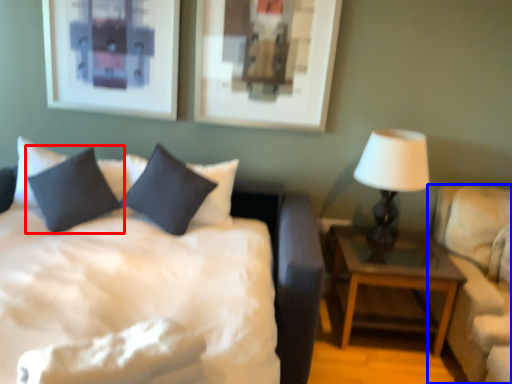
Question: Which point is closer to the camera, pillow (highlighted by a red box) or studio couch (highlighted by a blue box)?

Choices:
 (A) pillow
 (B) studio couch

Answer: (B)